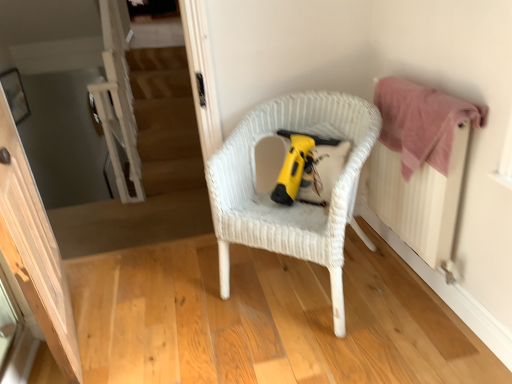
Locate an element on the screen. Image resolution: width=512 pixels, height=384 pixels. vacant space underneath white wicker chair at center (from a real-world perspective) is located at coordinates [x=289, y=289].